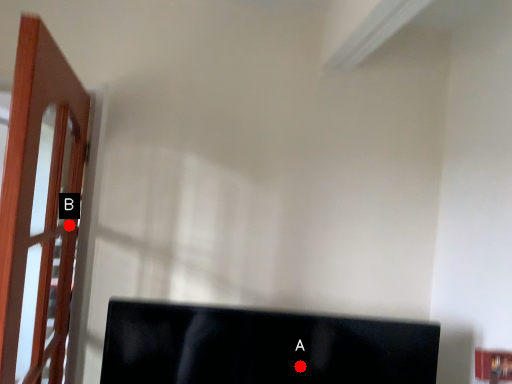
Question: Two points are circled on the image, labeled by A and B beside each circle. Which of the following is the farthest from the observer?

Choices:
 (A) A is further
 (B) B is further

Answer: (B)